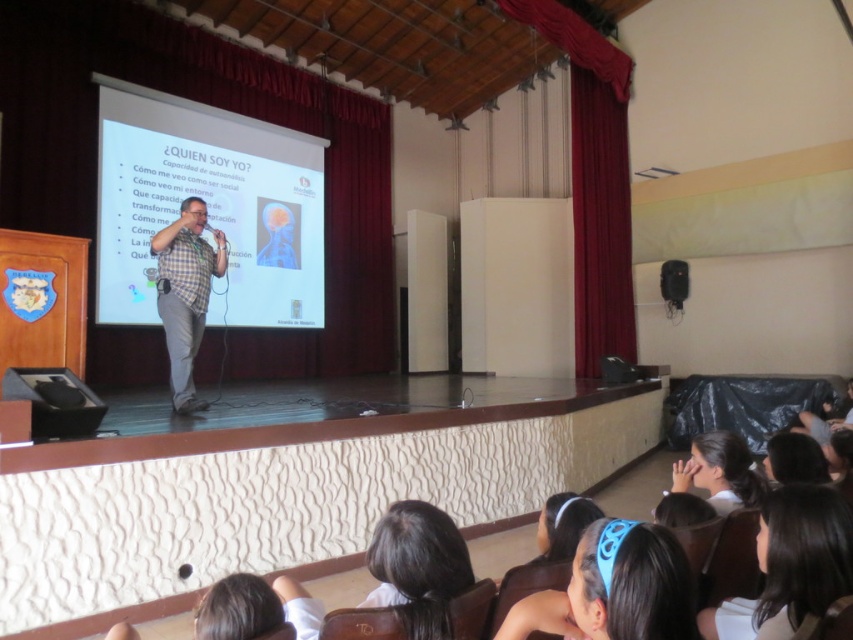
You are an event planner setting up a new projector in the classroom. The projector needs to be positioned so that its beam can reach both the white matte projection screen at center and the plaid shirt at center without obstruction. Considering their heights, which object requires the projector to be placed higher to ensure the beam reaches it?

The white matte projection screen at center is much taller than the plaid shirt at center, so the projector needs to be placed higher to reach the white matte projection screen at center.

You are sitting in the audience and looking at the stage. There are two points marked on the stage. One is at coordinate point (311, 211) and the other at point (181, 353). Which point is closer to you?

Point (311, 211) is further to the viewer than point (181, 353), so the point closer to you is point (181, 353).